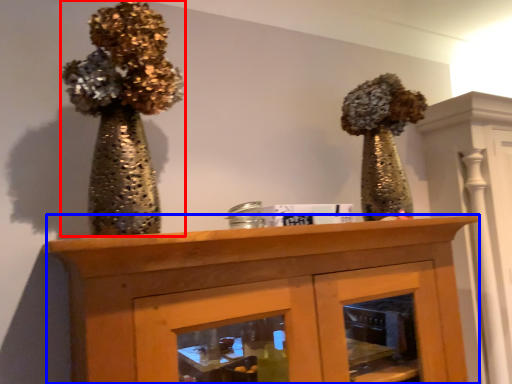
Question: Which of the following is the farthest to the observer, floral arrangement (highlighted by a red box) or furniture (highlighted by a blue box)?

Choices:
 (A) floral arrangement
 (B) furniture

Answer: (A)